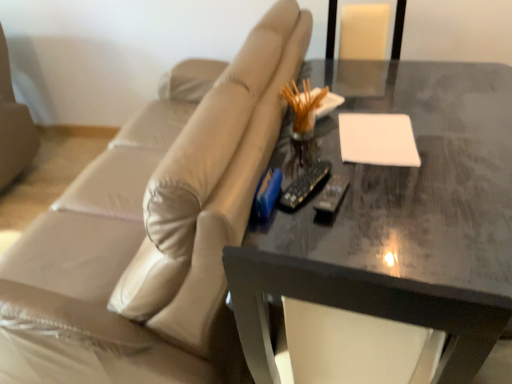
This screenshot has width=512, height=384. In order to click on free location to the right of white matte notepad at upper right in this screenshot , I will do `click(451, 137)`.